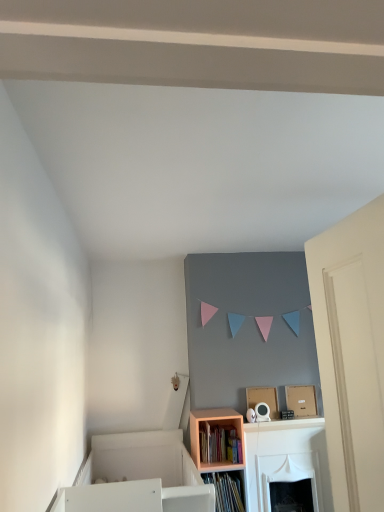
Question: In terms of size, does peach wood shelf at lower center appear bigger or smaller than wooden bookshelf at lower center?

Choices:
 (A) small
 (B) big

Answer: (B)

Question: Does point (226, 465) appear closer or farther from the camera than point (226, 439)?

Choices:
 (A) closer
 (B) farther

Answer: (A)

Question: Looking at their shapes, would you say peach wood shelf at lower center is wider or thinner than wooden bookshelf at lower center?

Choices:
 (A) thin
 (B) wide

Answer: (B)

Question: Is wooden bookshelf at lower center inside or outside of peach wood shelf at lower center?

Choices:
 (A) inside
 (B) outside

Answer: (A)

Question: Considering the relative positions of wooden bookshelf at lower center and peach wood shelf at lower center in the image provided, is wooden bookshelf at lower center to the left or to the right of peach wood shelf at lower center?

Choices:
 (A) left
 (B) right

Answer: (A)

Question: Relative to peach wood shelf at lower center, is wooden bookshelf at lower center in front or behind?

Choices:
 (A) front
 (B) behind

Answer: (B)

Question: Is point (206, 423) closer or farther from the camera than point (200, 413)?

Choices:
 (A) closer
 (B) farther

Answer: (A)